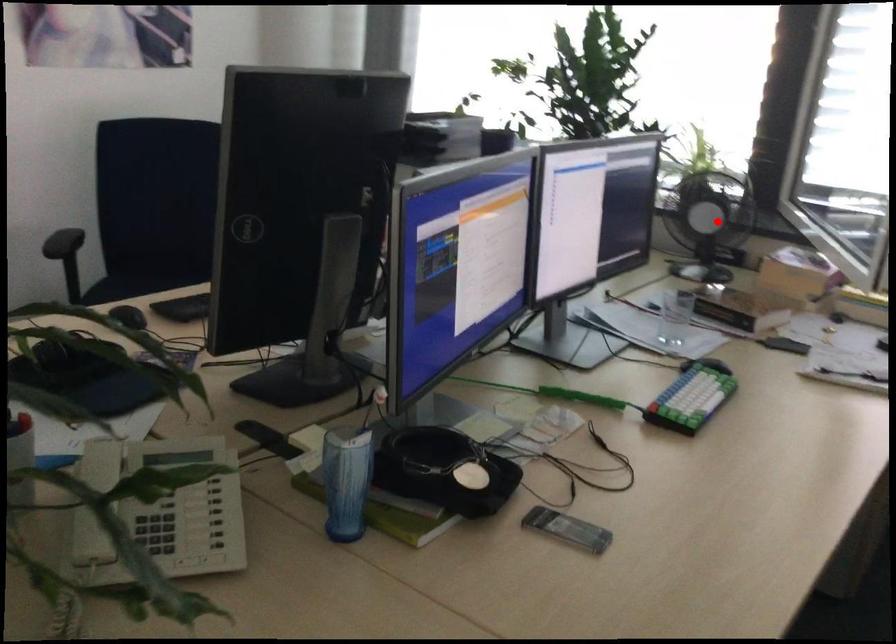
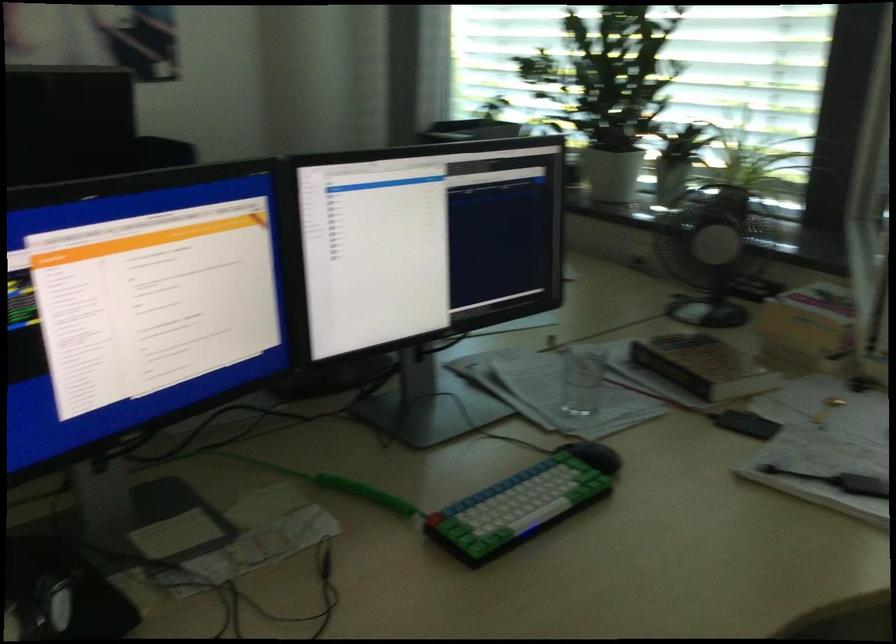
Question: A red point is marked in image1. In image2, is the corresponding 3D point closer to the camera or farther? Reply with the corresponding letter.

Choices:
 (A) The corresponding 3D point is closer.
 (B) The corresponding 3D point is farther.

Answer: (A)